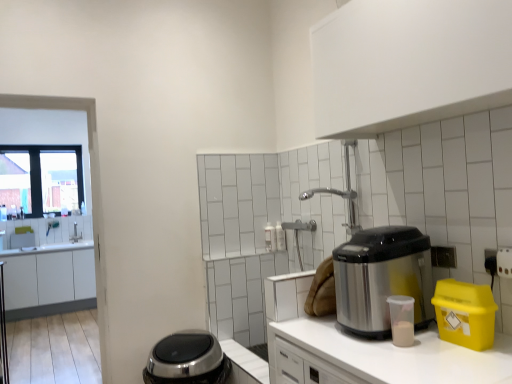
Question: Is satin silver appliance at lower center, acting as the first appliance starting from the bottom, inside the boundaries of white matte countertop at center, or outside?

Choices:
 (A) outside
 (B) inside

Answer: (A)

Question: In the image, is satin silver appliance at lower center, acting as the first appliance starting from the bottom, positioned in front of or behind white matte countertop at center?

Choices:
 (A) behind
 (B) front

Answer: (A)

Question: Which is nearer to the satin silver appliance at lower center, marked as the 2th appliance in a right-to-left arrangement?

Choices:
 (A) yellow plastic bin at right, placed as the first appliance when sorted from right to left
 (B) stainless steel appliance at right
 (C) white matte countertop at center
 (D) white matte cabinet at left, the second cabinetry viewed from the front
 (E) white matte cabinet at upper center, the 1th cabinetry from the front

Answer: (C)

Question: Which is farther from the satin silver appliance at lower center, arranged as the first appliance when viewed from the back?

Choices:
 (A) yellow plastic bin at right, which appears as the first appliance when viewed from the top
 (B) stainless steel appliance at right
 (C) white matte countertop at center
 (D) clear glass window at upper left
 (E) white matte cabinet at left, the first cabinetry ordered from the bottom

Answer: (D)